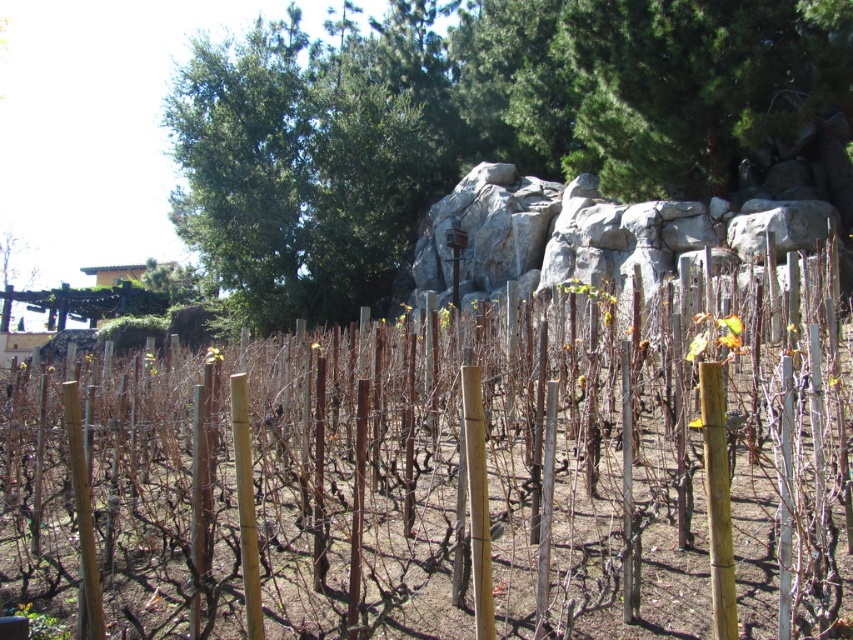
You are standing in the vineyard and want to walk from the brown wooden post at center to the gray rock at center. Which direction should you head?

You should head to the right because the gray rock at center is to the right of the brown wooden post at center.

You are standing at the point marked as point (x=587, y=234) in the vineyard. What is the nearest object to you?

The nearest object to you is the gray rock at center located at point (x=587, y=234).

You are a hiker who wants to take a photo of the gray rock at center and the green leafy tree at upper left. Based on their positions, which object should you focus on first if you want to capture both in a single frame without moving your camera?

You should focus on the green leafy tree at upper left first because the gray rock at center is positioned to the right of it, so by centering the tree in your frame, you can adjust the camera angle to include the rock to the right without moving the camera.